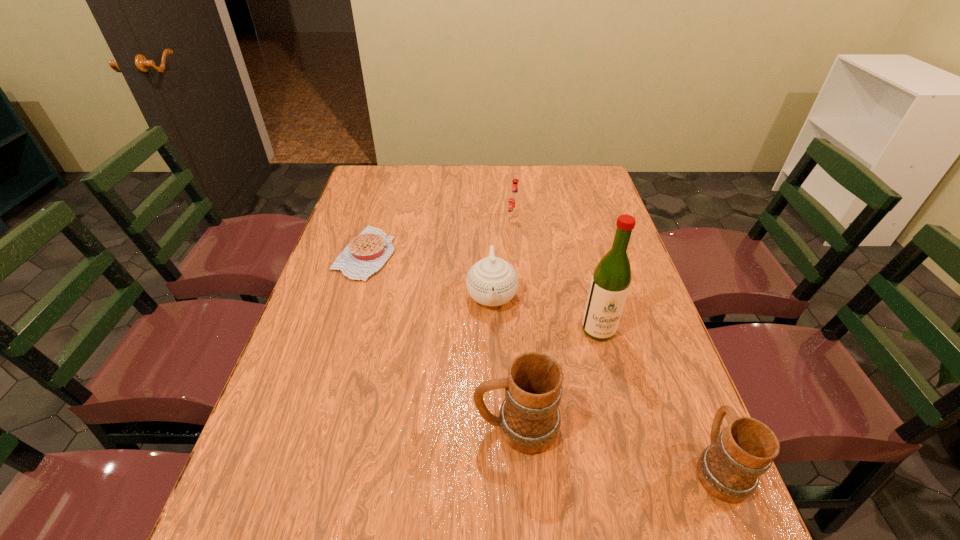
In order to click on vacant space that is in between the taller mug and the root beer in this screenshot , I will do `click(515, 323)`.

The image size is (960, 540). I want to click on vacant area between the root beer and the chinaware, so click(x=503, y=256).

Locate an element on the screen. This screenshot has height=540, width=960. unoccupied position between the left mug and the chinaware is located at coordinates (504, 361).

At what (x,y) coordinates should I click in order to perform the action: click on free space between the rightmost object and the chinaware. Please return your answer as a coordinate pair (x, y). The image size is (960, 540). Looking at the image, I should click on (605, 381).

Locate an element on the screen. free space between the liquor and the root beer is located at coordinates (556, 274).

The height and width of the screenshot is (540, 960). In order to click on free spot between the pie and the root beer in this screenshot , I will do pyautogui.click(x=440, y=236).

Locate an element on the screen. This screenshot has height=540, width=960. free point between the chinaware and the pie is located at coordinates (429, 274).

Find the location of a particular element. Image resolution: width=960 pixels, height=540 pixels. free space between the left mug and the farthest object is located at coordinates (515, 323).

Identify the location of the fourth closest object to the tallest object. (514, 200).

Select which object is the third closest to the shortest object. Please provide its 2D coordinates. Your answer should be formatted as a tuple, i.e. [(x, y)], where the tuple contains the x and y coordinates of a point satisfying the conditions above.

[(529, 419)]